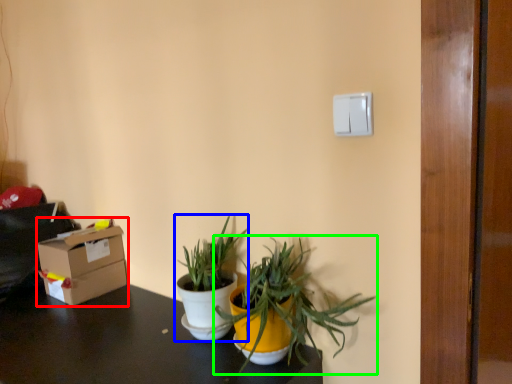
Question: Which object is positioned closest to box (highlighted by a red box)? Select from houseplant (highlighted by a blue box) and houseplant (highlighted by a green box).

Choices:
 (A) houseplant
 (B) houseplant

Answer: (A)